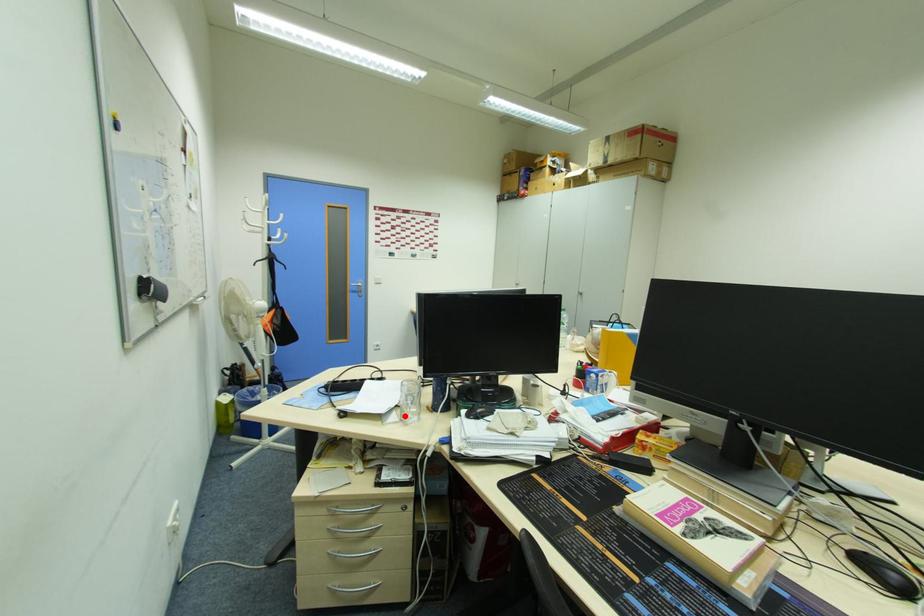
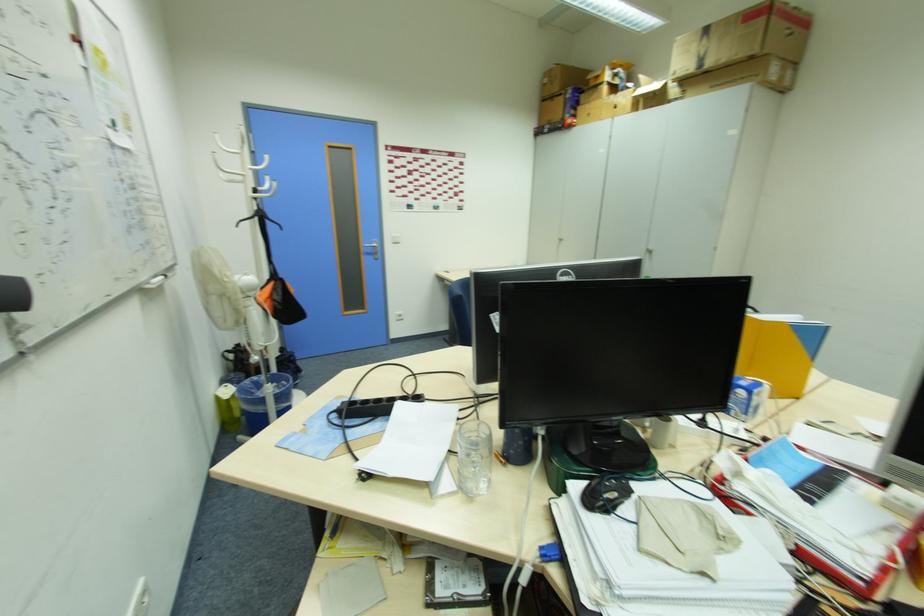
Where in the second image is the point corresponding to the highlighted location from the first image?

(464, 483)